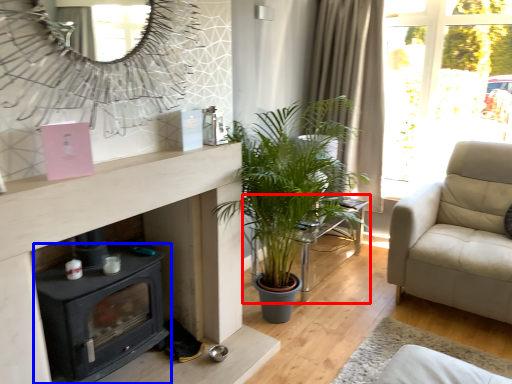
Question: Which point is further to the camera, table (highlighted by a red box) or wood burning stove (highlighted by a blue box)?

Choices:
 (A) table
 (B) wood burning stove

Answer: (A)